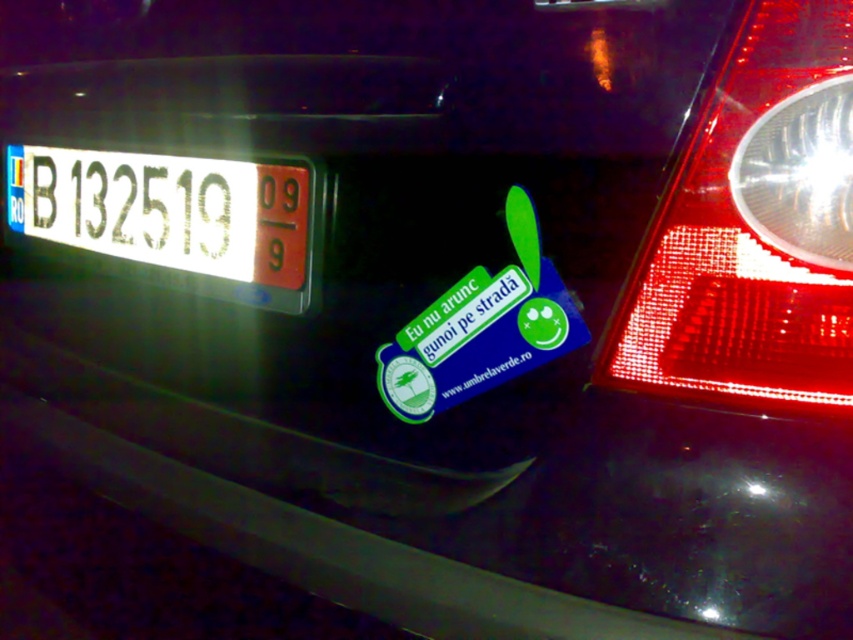
Question: Does transparent plastic tail light at right appear on the right side of blue glossy sticker at center?

Choices:
 (A) yes
 (B) no

Answer: (A)

Question: Which point is closer to the camera?

Choices:
 (A) blue glossy sticker at center
 (B) transparent plastic tail light at right
 (C) white plastic license plate at center

Answer: (B)

Question: Which of the following is the farthest from the observer?

Choices:
 (A) (650, 241)
 (B) (393, 339)
 (C) (262, 168)

Answer: (C)

Question: Is white plastic license plate at center smaller than blue glossy sticker at center?

Choices:
 (A) yes
 (B) no

Answer: (B)

Question: Which point is closer to the camera?

Choices:
 (A) transparent plastic tail light at right
 (B) blue glossy sticker at center
 (C) white plastic license plate at center

Answer: (A)

Question: Is the position of white plastic license plate at center more distant than that of blue glossy sticker at center?

Choices:
 (A) no
 (B) yes

Answer: (B)